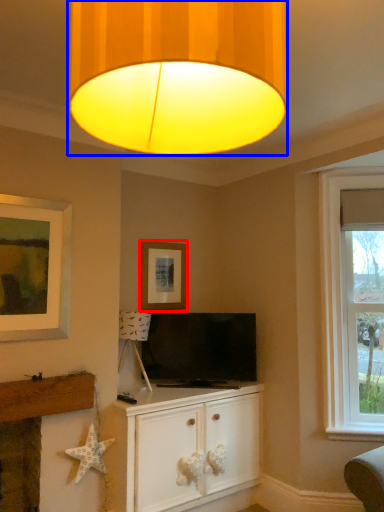
Question: Which of the following is the closest to the observer, picture frame (highlighted by a red box) or lamp (highlighted by a blue box)?

Choices:
 (A) picture frame
 (B) lamp

Answer: (B)